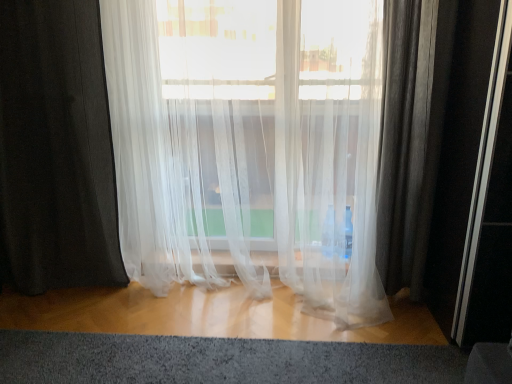
This screenshot has height=384, width=512. I want to click on vacant space underneath black sheer curtain at left, the 1th curtain viewed from the left (from a real-world perspective), so click(72, 289).